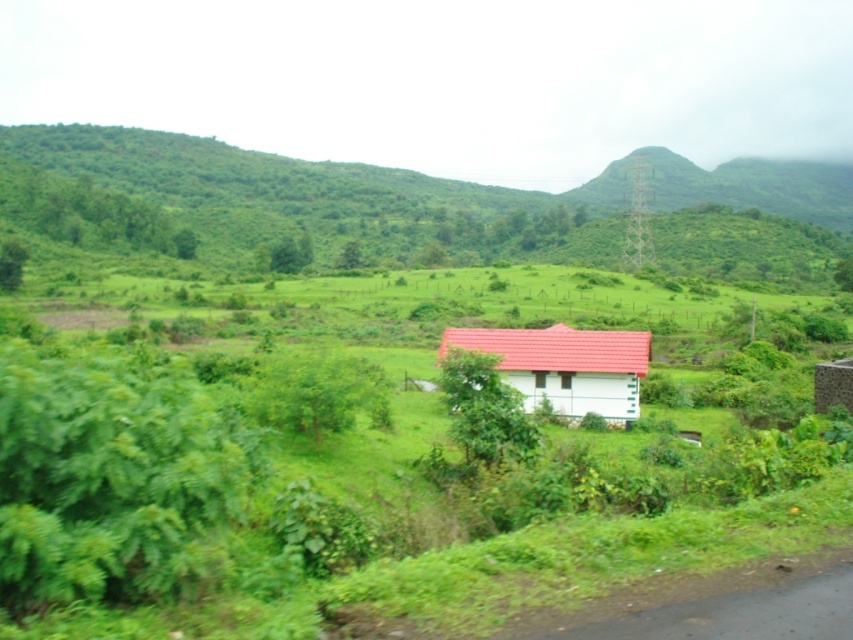
Question: Estimate the real-world distances between objects in this image. Which object is farther from the transparent glass train window at center?

Choices:
 (A) green grassy hillside at left
 (B) white matte house at center

Answer: (A)

Question: Which point is closer to the camera taking this photo?

Choices:
 (A) (515, 333)
 (B) (541, 374)
 (C) (569, 378)
 (D) (184, 147)

Answer: (C)

Question: Can you confirm if white matte house at center is thinner than transparent glass train window at center?

Choices:
 (A) yes
 (B) no

Answer: (B)

Question: Is green grassy hillside at left positioned in front of transparent glass window at center?

Choices:
 (A) yes
 (B) no

Answer: (B)

Question: Is the position of transparent glass window at center less distant than that of transparent glass train window at center?

Choices:
 (A) yes
 (B) no

Answer: (A)

Question: Among these objects, which one is nearest to the camera?

Choices:
 (A) transparent glass window at center
 (B) white matte house at center
 (C) green grassy hillside at left

Answer: (B)